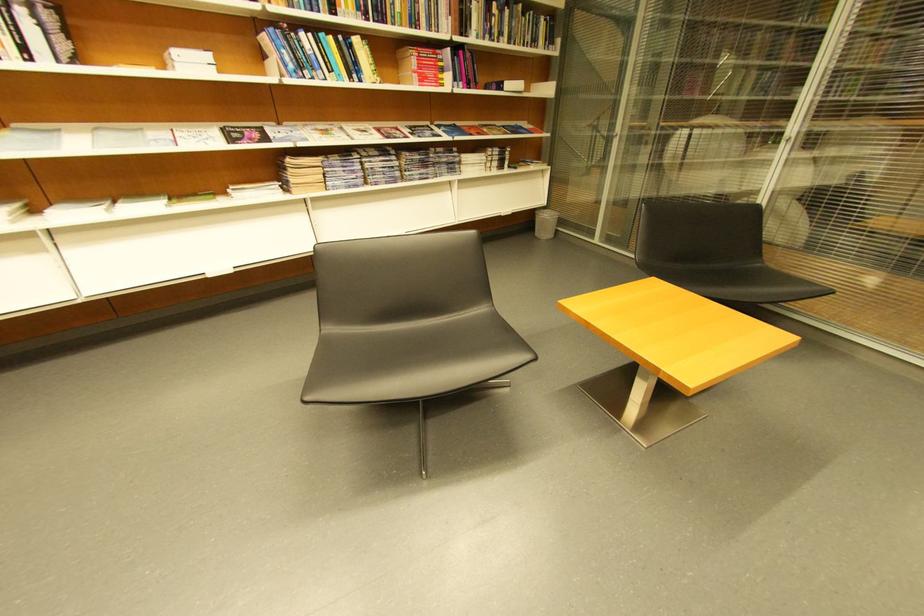
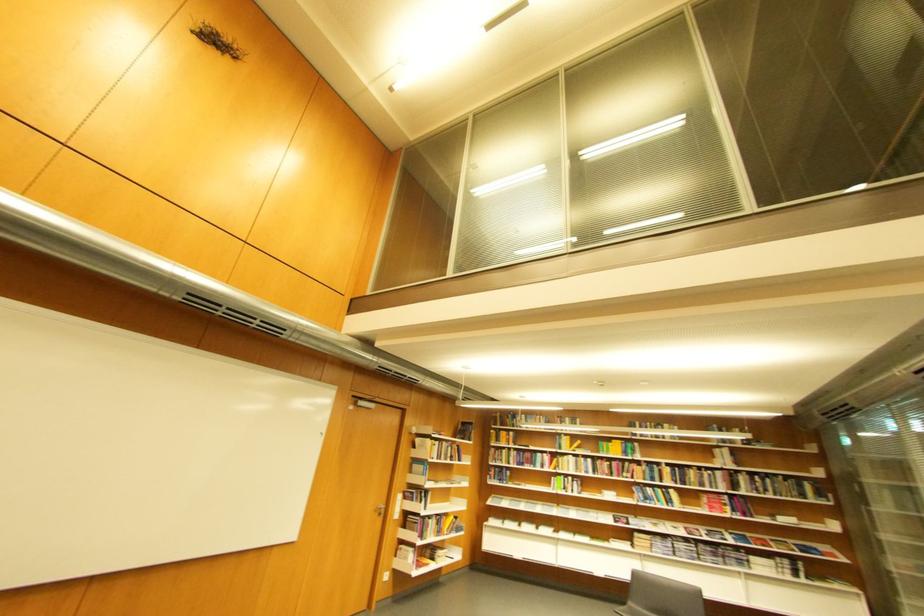
In the second image, find the point that corresponds to point (363, 172) in the first image.

(677, 549)